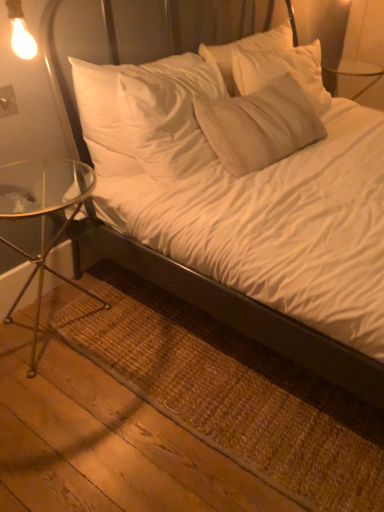
This screenshot has width=384, height=512. I want to click on free space above brown woven mat at lower left (from a real-world perspective), so click(205, 357).